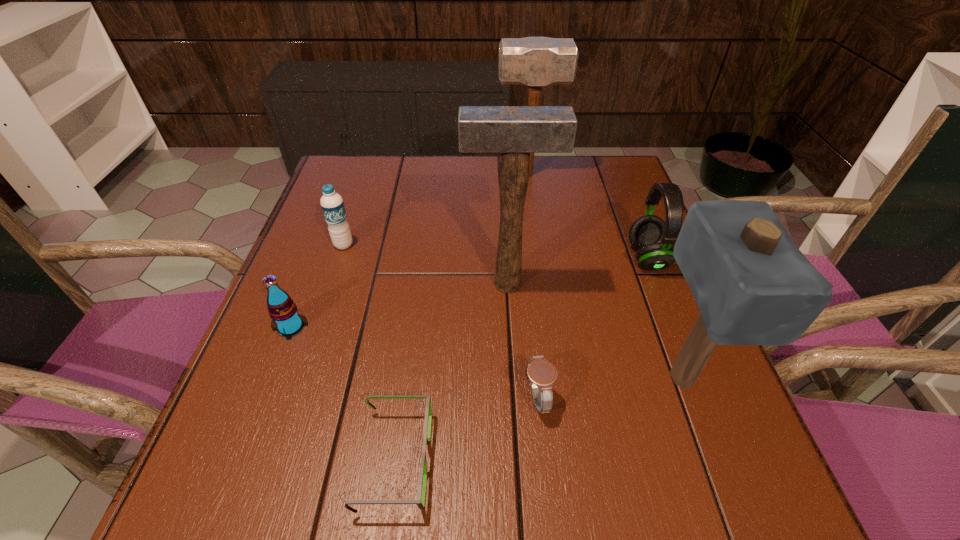
The image size is (960, 540). Identify the location of blank space at the right edge of the desktop. (625, 368).

Identify the location of vacant space at the far left corner of the desktop. The image size is (960, 540). (363, 197).

Locate an element on the screen. free space between the second nearest mallet and the water bottle is located at coordinates (425, 264).

The image size is (960, 540). Find the location of `vacant area that lies between the rightmost mallet and the second nearest mallet`. vacant area that lies between the rightmost mallet and the second nearest mallet is located at coordinates (594, 330).

This screenshot has height=540, width=960. I want to click on free spot between the third object from left to right and the rightmost mallet, so click(539, 418).

This screenshot has height=540, width=960. Find the location of `unoccupied area between the third object from left to right and the second farthest mallet`. unoccupied area between the third object from left to right and the second farthest mallet is located at coordinates [451, 372].

Where is `vacant point located between the nearest mallet and the farthest mallet`? The image size is (960, 540). vacant point located between the nearest mallet and the farthest mallet is located at coordinates pos(604,276).

Find the location of `empty space between the second shortest object and the third object from left to right`. empty space between the second shortest object and the third object from left to right is located at coordinates (466, 429).

At what (x,y) coordinates should I click in order to perform the action: click on free spot between the watch and the sixth tallest object. Please return your answer as a coordinate pair (x, y). Image resolution: width=960 pixels, height=540 pixels. Looking at the image, I should click on (414, 362).

Where is `vacant area between the farthest object and the water bottle`? The width and height of the screenshot is (960, 540). vacant area between the farthest object and the water bottle is located at coordinates (436, 210).